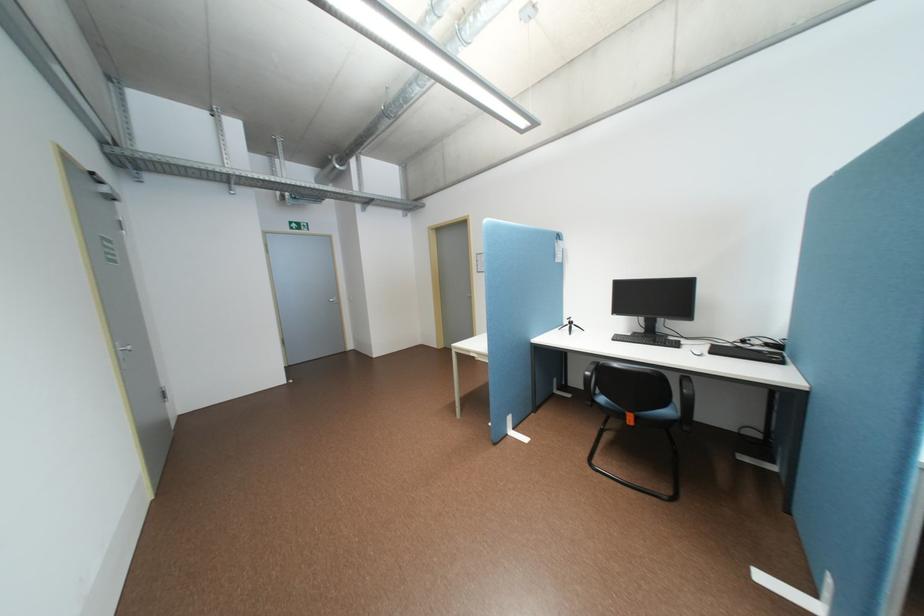
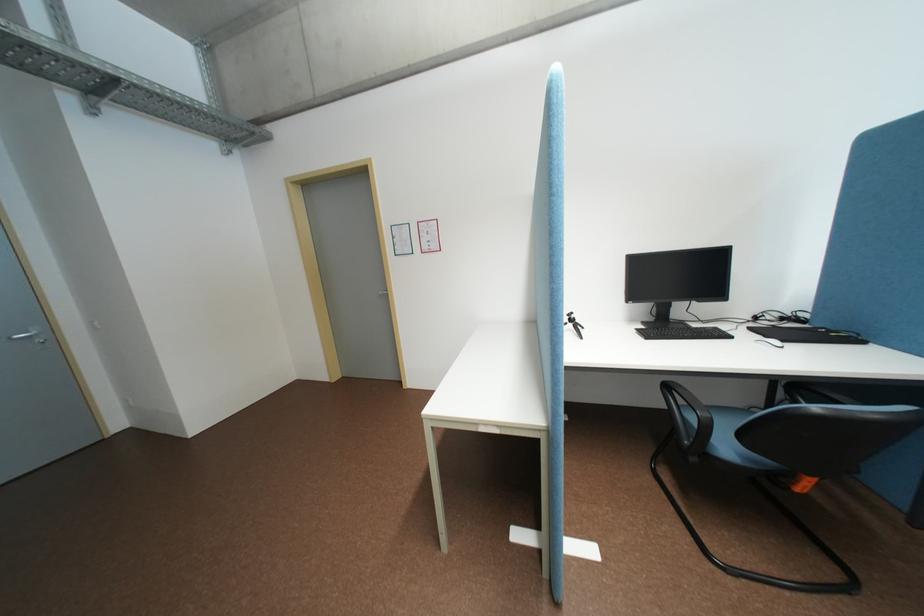
Find the pixel in the second image that matches [578,326] in the first image.

(581, 325)